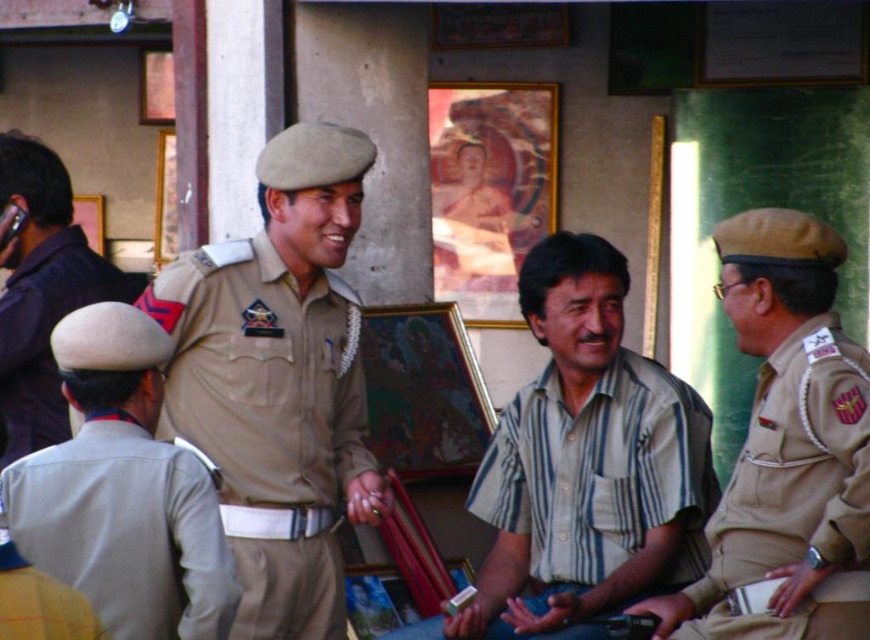
Can you confirm if matte khaki uniform at left is positioned above khaki fabric uniform at left?

Correct, matte khaki uniform at left is located above khaki fabric uniform at left.

Between matte khaki uniform at left and khaki fabric uniform at left, which one has more height?

matte khaki uniform at left

What do you see at coordinates (126, 531) in the screenshot?
I see `matte khaki uniform at left` at bounding box center [126, 531].

Find the location of a particular element. Image resolution: width=870 pixels, height=640 pixels. matte khaki uniform at left is located at coordinates (126, 531).

Can you confirm if matte khaki uniform at center is bigger than khaki fabric uniform at left?

Correct, matte khaki uniform at center is larger in size than khaki fabric uniform at left.

Does matte khaki uniform at center appear under khaki fabric uniform at left?

No.

Is point (298, 288) less distant than point (44, 637)?

No, (298, 288) is behind (44, 637).

Identify the location of matte khaki uniform at center. (269, 420).

Can you confirm if striped cotton shirt at center is positioned to the left of matte khaki uniform at center?

In fact, striped cotton shirt at center is to the right of matte khaki uniform at center.

Which is behind, point (577, 481) or point (343, 364)?

The point (343, 364) is behind.

Between point (674, 400) and point (155, 301), which one is positioned in front?

Point (155, 301) is more forward.

This screenshot has height=640, width=870. In order to click on striped cotton shirt at center in this screenshot , I will do `click(586, 461)`.